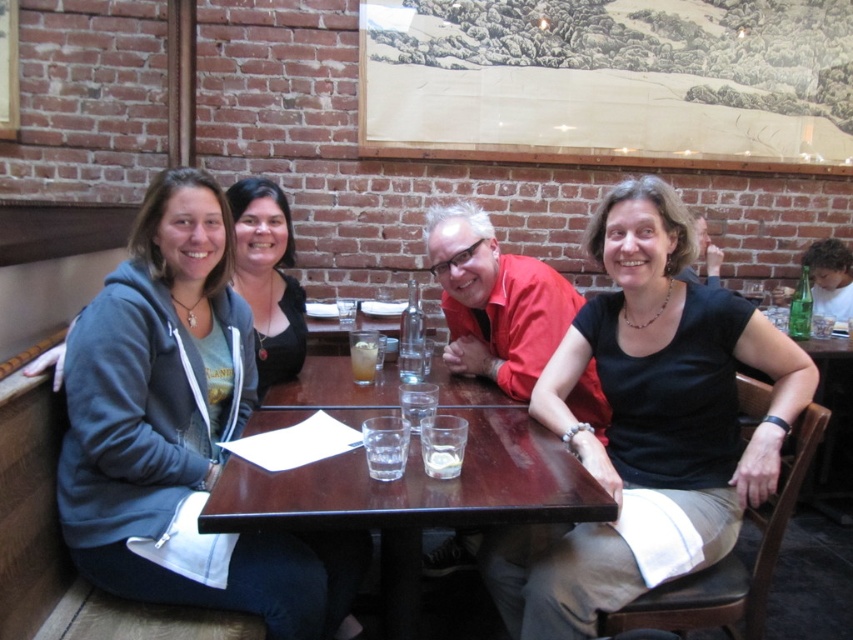
Does black matte shirt at center appear over translucent glass drink at table center?

No.

Which is in front, point (631, 224) or point (361, 358)?

Positioned in front is point (631, 224).

What do you see at coordinates (671, 374) in the screenshot? The height and width of the screenshot is (640, 853). I see `black matte shirt at center` at bounding box center [671, 374].

Image resolution: width=853 pixels, height=640 pixels. I want to click on black matte shirt at center, so click(671, 374).

Does matte gray hoodie at left have a lesser width compared to matte black shirt at center?

No.

Is point (231, 538) behind point (281, 307)?

No.

I want to click on matte gray hoodie at left, so click(x=181, y=432).

Does matte gray hoodie at left have a smaller size compared to black matte shirt at center?

Correct, matte gray hoodie at left occupies less space than black matte shirt at center.

Does point (180, 480) come farther from viewer compared to point (663, 291)?

No, it is not.

Who is more distant from viewer, (163, 545) or (683, 356)?

The point (683, 356) is more distant.

Find the location of a particular element. This screenshot has height=640, width=853. matte gray hoodie at left is located at coordinates (181, 432).